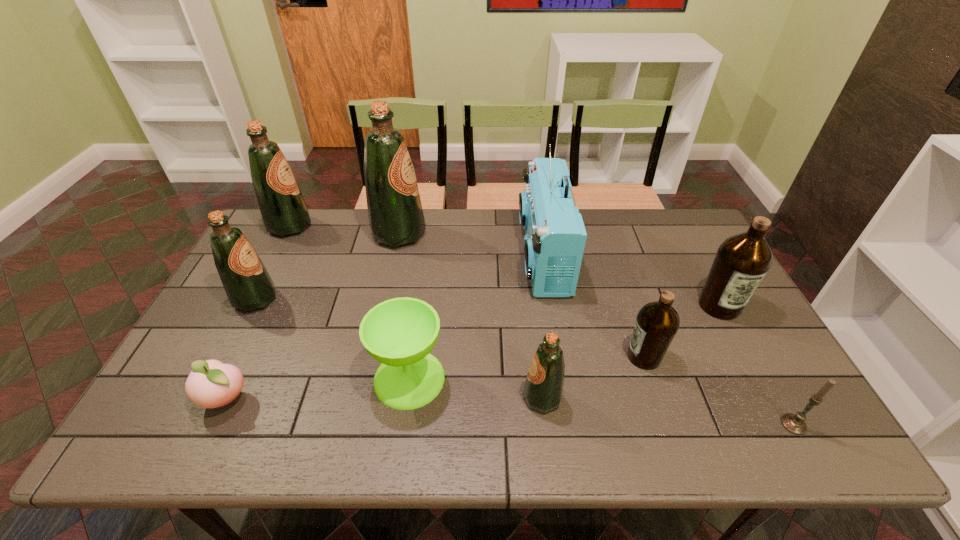
Find the location of a particular element. The image size is (960, 540). object at the near right corner is located at coordinates (795, 424).

Locate an element on the screen. free space at the far edge of the desktop is located at coordinates (492, 238).

Identify the location of vacant space at the left edge. (220, 352).

You are a GUI agent. You are given a task and a screenshot of the screen. Output one action in this format:
    pyautogui.click(x=<x>, y=<y>)
    Task: Click on the vacant area at the right edge
    This screenshot has width=960, height=540.
    Given the screenshot: What is the action you would take?
    pyautogui.click(x=727, y=339)

The width and height of the screenshot is (960, 540). I want to click on vacant region at the far right corner of the desktop, so click(x=673, y=244).

Identify the location of vacant space at the near right corner of the desktop. (819, 447).

In order to click on vacant point located between the shortest object and the wineglass in this screenshot , I will do `click(318, 389)`.

The height and width of the screenshot is (540, 960). I want to click on vacant point located between the third object from right to left and the nearest green olive oil, so click(x=593, y=377).

Identify the location of free point between the wineglass and the shortest object. The image size is (960, 540). (318, 389).

Image resolution: width=960 pixels, height=540 pixels. What are the coordinates of `empty location between the shortest object and the rightmost olive oil` in the screenshot? It's located at (472, 353).